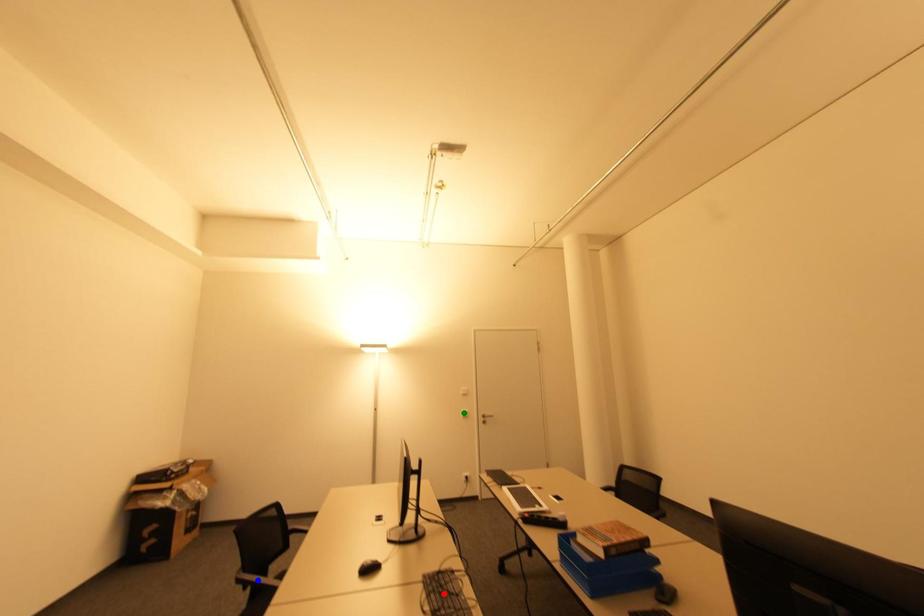
Order these from nearest to farthest:
blue point, green point, red point

red point
blue point
green point